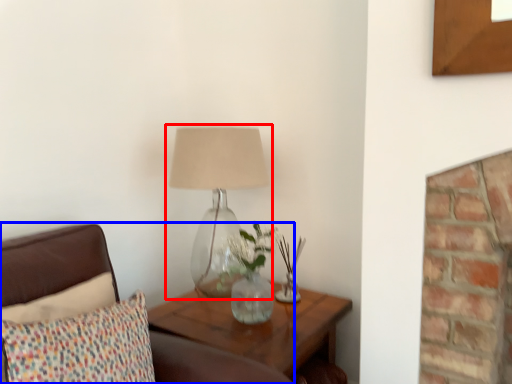
Question: Which object appears closest to the camera in this image, lamp (highlighted by a red box) or furniture (highlighted by a blue box)?

Choices:
 (A) lamp
 (B) furniture

Answer: (B)